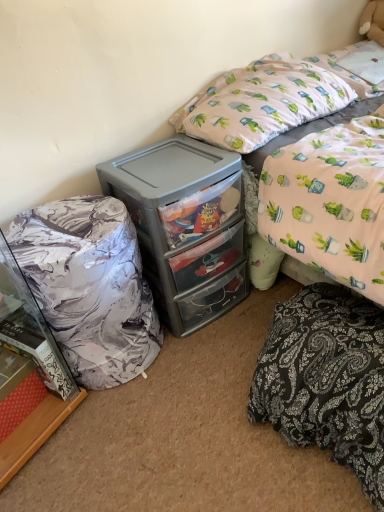
Locate an element on the screen. This screenshot has width=384, height=512. free location in front of marble-patterned bean bag at left is located at coordinates (130, 434).